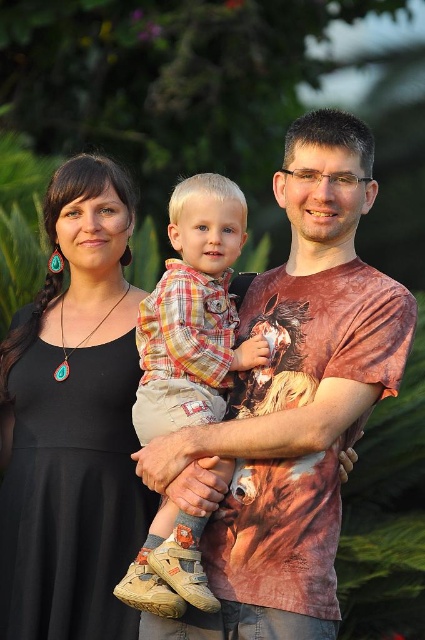
Is matte brown t-shirt at center smaller than plaid cotton shirt at center?

Incorrect, matte brown t-shirt at center is not smaller in size than plaid cotton shirt at center.

Does point (203, 480) come farther from viewer compared to point (173, 292)?

That is False.

Is point (257, 420) positioned in front of point (198, 378)?

Yes, it is in front of point (198, 378).

Where is `matte brown t-shirt at center`? This screenshot has width=425, height=640. matte brown t-shirt at center is located at coordinates (291, 404).

Between black fabric dress at left and plaid cotton shirt at center, which one appears on the right side from the viewer's perspective?

plaid cotton shirt at center is more to the right.

Looking at this image, can you confirm if black fabric dress at left is positioned above plaid cotton shirt at center?

Incorrect, black fabric dress at left is not positioned above plaid cotton shirt at center.

The image size is (425, 640). I want to click on black fabric dress at left, so click(73, 422).

Locate an element on the screen. The image size is (425, 640). black fabric dress at left is located at coordinates (73, 422).

Is matte brown t-shirt at center further to camera compared to black fabric dress at left?

No.

Can you confirm if matte brown t-shirt at center is thinner than black fabric dress at left?

Incorrect, matte brown t-shirt at center's width is not less than black fabric dress at left's.

Between point (336, 301) and point (36, 483), which one is positioned in front?

Point (336, 301) is in front.

Where is `matte brown t-shirt at center`? This screenshot has height=640, width=425. matte brown t-shirt at center is located at coordinates (291, 404).